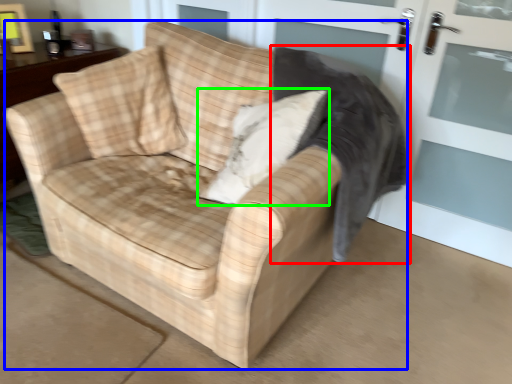
Question: Based on their relative distances, which object is nearer to rocking chair (highlighted by a red box)? Choose from studio couch (highlighted by a blue box) and throw pillow (highlighted by a green box).

Choices:
 (A) studio couch
 (B) throw pillow

Answer: (B)